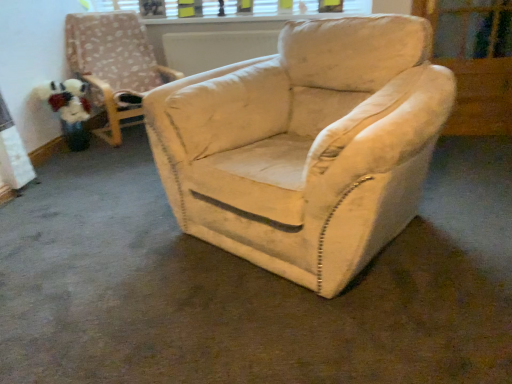
Question: From a real-world perspective, is velvet beige armchair at center physically below transparent glass screen door at upper right?

Choices:
 (A) yes
 (B) no

Answer: (B)

Question: Is velvet beige armchair at center thinner than transparent glass screen door at upper right?

Choices:
 (A) yes
 (B) no

Answer: (B)

Question: From a real-world perspective, is velvet beige armchair at center on transparent glass screen door at upper right?

Choices:
 (A) no
 (B) yes

Answer: (B)

Question: Is the surface of velvet beige armchair at center in direct contact with transparent glass screen door at upper right?

Choices:
 (A) yes
 (B) no

Answer: (B)

Question: Is velvet beige armchair at center smaller than transparent glass screen door at upper right?

Choices:
 (A) yes
 (B) no

Answer: (B)

Question: Is velvet beige armchair at center closer to the viewer compared to transparent glass screen door at upper right?

Choices:
 (A) yes
 (B) no

Answer: (B)

Question: Considering the relative positions of velvet beige armchair at center and fluffy fabric toy at left in the image provided, is velvet beige armchair at center to the right of fluffy fabric toy at left from the viewer's perspective?

Choices:
 (A) no
 (B) yes

Answer: (B)

Question: Does velvet beige armchair at center have a lesser height compared to fluffy fabric toy at left?

Choices:
 (A) no
 (B) yes

Answer: (A)

Question: Considering the relative sizes of velvet beige armchair at center and fluffy fabric toy at left in the image provided, is velvet beige armchair at center wider than fluffy fabric toy at left?

Choices:
 (A) no
 (B) yes

Answer: (B)

Question: Is velvet beige armchair at center located outside fluffy fabric toy at left?

Choices:
 (A) no
 (B) yes

Answer: (B)

Question: From the image's perspective, is velvet beige armchair at center located above fluffy fabric toy at left?

Choices:
 (A) yes
 (B) no

Answer: (A)

Question: Is velvet beige armchair at center positioned with its back to fluffy fabric toy at left?

Choices:
 (A) no
 (B) yes

Answer: (A)

Question: Is transparent glass screen door at upper right positioned with its back to white plastic window frame at upper center?

Choices:
 (A) yes
 (B) no

Answer: (B)